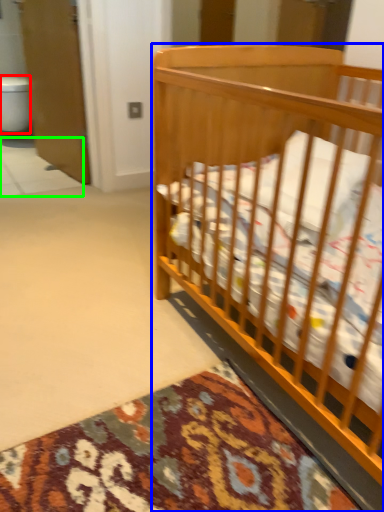
Question: Based on their relative distances, which object is nearer to toilet bowl (highlighted by a red box)? Choose from infant bed (highlighted by a blue box) and tile (highlighted by a green box).

Choices:
 (A) infant bed
 (B) tile

Answer: (B)